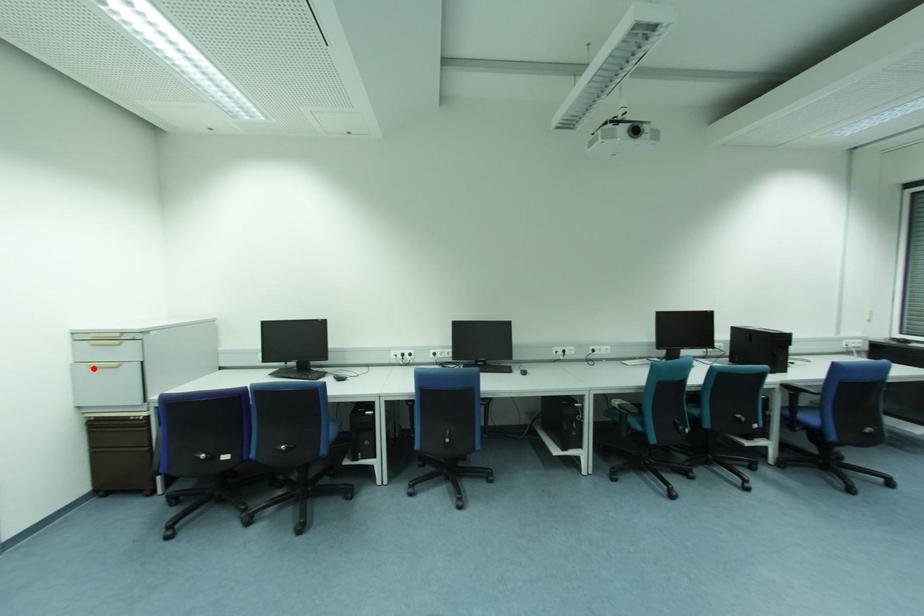
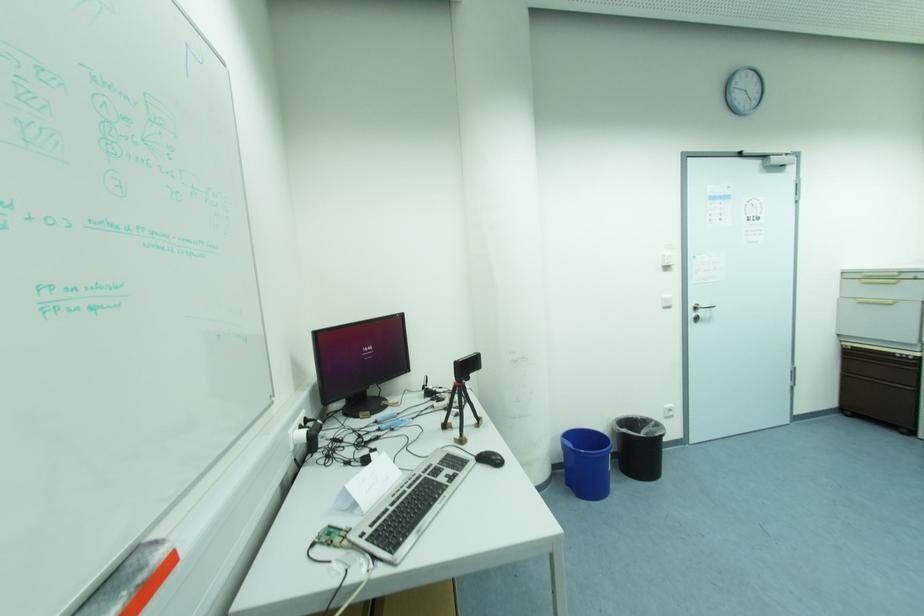
Question: I am providing you with two images of the same scene from different viewpoints. Image1 has a red point marked. In image2, the corresponding 3D location appears at what relative position? Reply with the corresponding letter.

Choices:
 (A) Closer
 (B) Farther

Answer: (A)